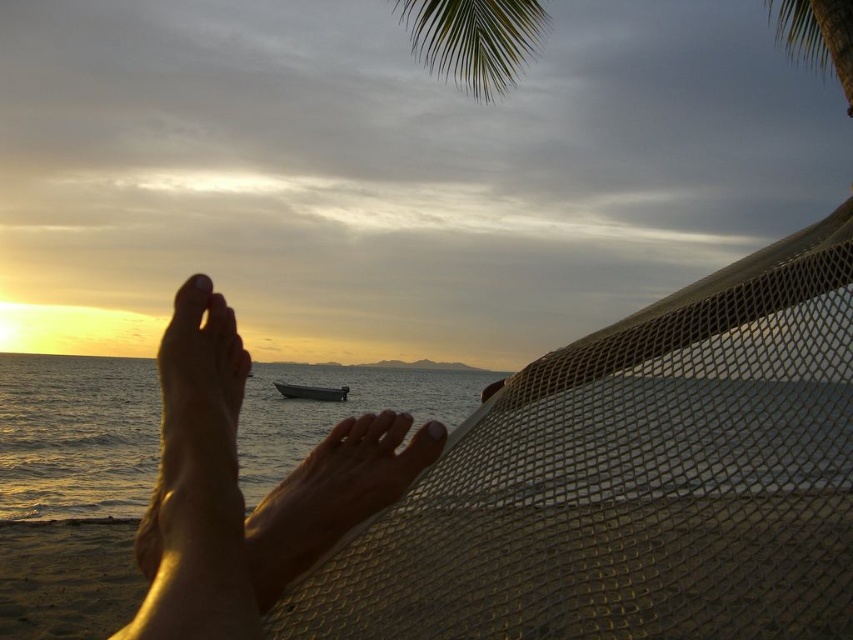
You are standing on the beach and see the skinny bare feet at lower left and the smooth skin at center. Which one is closer to your right side?

The smooth skin at center is closer to your right side because the skinny bare feet at lower left are positioned to the left of it.